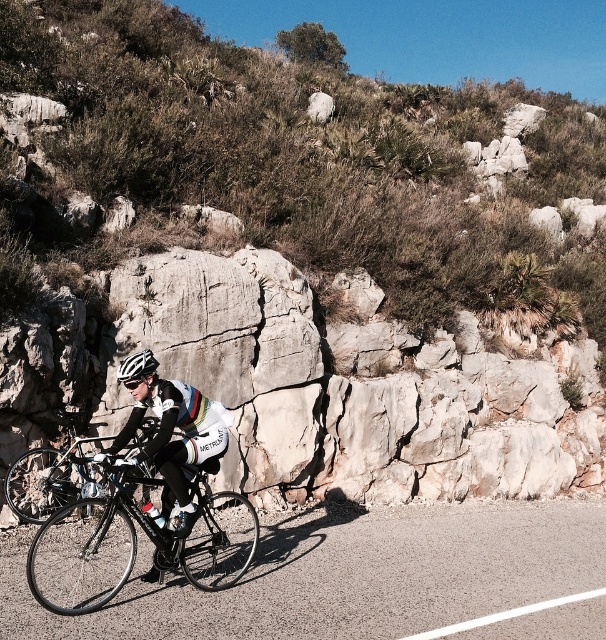
Question: Which point is farther to the camera?

Choices:
 (A) white matte bicycle helmet at center
 (B) white matte cycling jersey at center
 (C) black asphalt road at center
 (D) shiny black bicycle at center

Answer: (A)

Question: Which of the following is the closest to the observer?

Choices:
 (A) black asphalt road at center
 (B) white matte bicycle helmet at center
 (C) shiny black bicycle at center

Answer: (A)

Question: Estimate the real-world distances between objects in this image. Which object is closer to the white matte cycling jersey at center?

Choices:
 (A) shiny black bicycle at center
 (B) white matte bicycle helmet at center

Answer: (B)

Question: Can you confirm if black asphalt road at center is bigger than white matte cycling jersey at center?

Choices:
 (A) no
 (B) yes

Answer: (A)

Question: Is black asphalt road at center in front of white matte bicycle helmet at center?

Choices:
 (A) yes
 (B) no

Answer: (A)

Question: Is shiny black bicycle at center behind white matte cycling jersey at center?

Choices:
 (A) yes
 (B) no

Answer: (B)